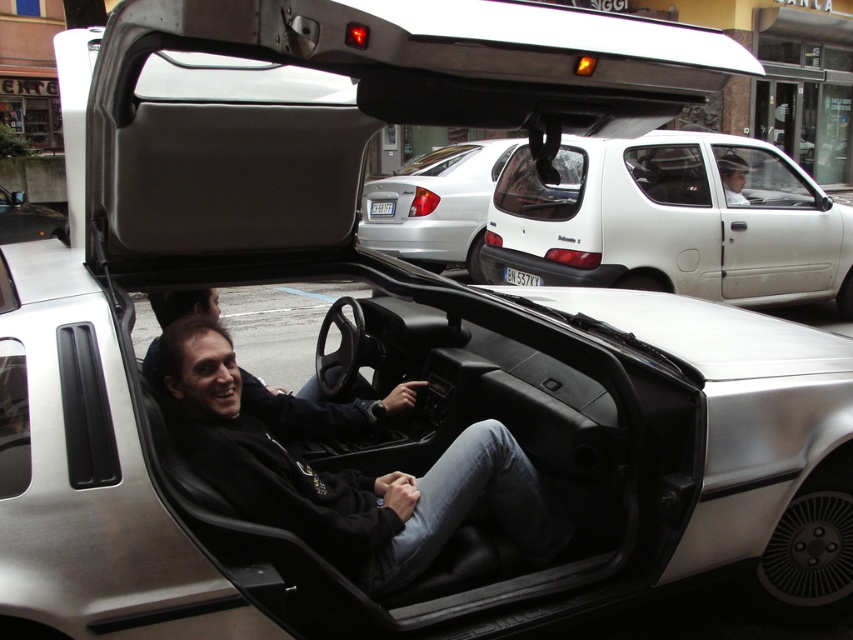
Does point (397, 410) come behind point (525, 278)?

No, it is in front of (525, 278).

Can you confirm if matte black jacket at center is positioned below black plastic license plate at center?

Yes.

Does point (279, 426) lie in front of point (541, 280)?

Yes, it is.

Locate an element on the screen. matte black jacket at center is located at coordinates (322, 410).

Does matte black jacket at center have a greater width compared to white plastic license plate at center?

Yes, matte black jacket at center is wider than white plastic license plate at center.

Can you confirm if matte black jacket at center is thinner than white plastic license plate at center?

No, matte black jacket at center is not thinner than white plastic license plate at center.

Image resolution: width=853 pixels, height=640 pixels. Describe the element at coordinates (322, 410) in the screenshot. I see `matte black jacket at center` at that location.

The width and height of the screenshot is (853, 640). Identify the location of matte black jacket at center. (322, 410).

Who is lower down, black leather jacket at center or matte black car at center?

Positioned lower is black leather jacket at center.

Does black leather jacket at center come behind matte black car at center?

No, black leather jacket at center is in front of matte black car at center.

I want to click on black leather jacket at center, so click(346, 476).